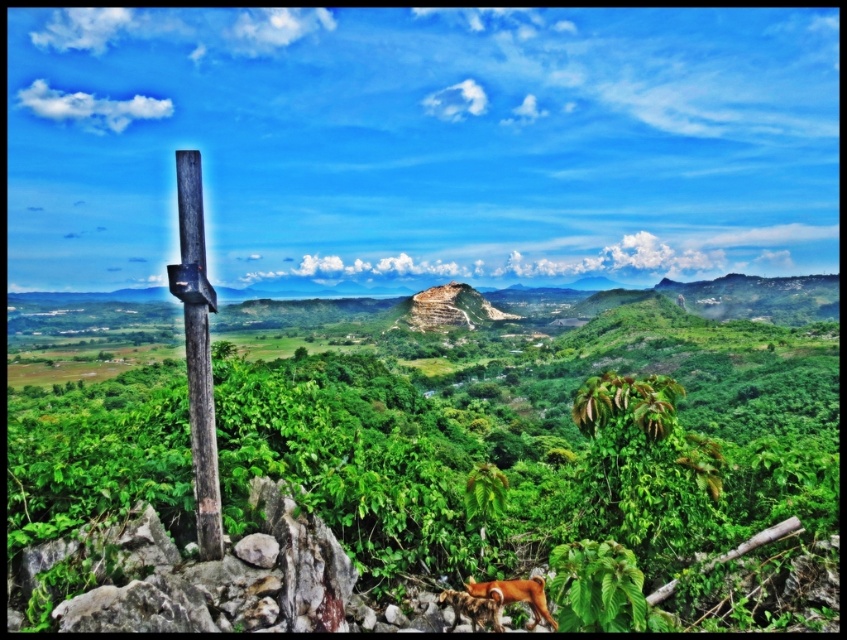
Does brown fur dog at lower right have a smaller size compared to brown furry dog at lower right?

No, brown fur dog at lower right is not smaller than brown furry dog at lower right.

Is point (519, 588) more distant than point (499, 627)?

Yes.

Identify the location of brown fur dog at lower right. This screenshot has width=847, height=640. (515, 595).

Does brown wooden pole at left lie behind brown fur dog at lower right?

No, brown wooden pole at left is in front of brown fur dog at lower right.

Where is `brown wooden pole at left`? The image size is (847, 640). brown wooden pole at left is located at coordinates (197, 349).

In the scene shown: Does green leafy vegetation at center have a lesser width compared to brown fur dog at lower right?

In fact, green leafy vegetation at center might be wider than brown fur dog at lower right.

Does point (57, 432) come farther from viewer compared to point (544, 608)?

Yes, point (57, 432) is behind point (544, 608).

Find the location of a particular element. The width and height of the screenshot is (847, 640). green leafy vegetation at center is located at coordinates (543, 452).